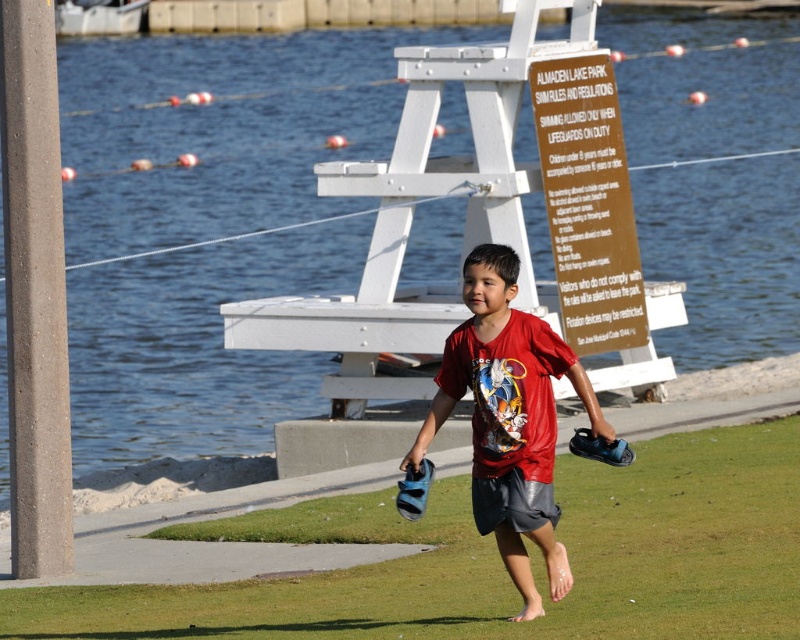
You are taking a photo of the two points in the scene. Which point, point (796, 540) or point (540, 150), will appear larger in your photo?

Point (796, 540) is closer to the camera than point (540, 150), so it will appear larger in the photo.

You are a photographer trying to capture a candid shot of the boy in the scene. You want to ensure that both the red matte shirt at center and the dark gray cotton shorts at center are clearly visible in the frame. Given their relative sizes, which clothing item will appear larger in the photo?

The red matte shirt at center will appear larger in the photo since it has a greater height compared to the dark gray cotton shorts at center.